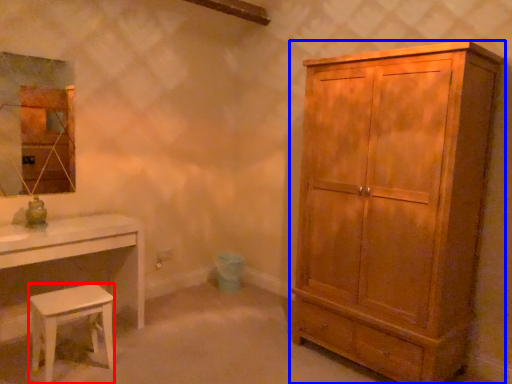
Question: Which object is further to the camera taking this photo, stool (highlighted by a red box) or cabinetry (highlighted by a blue box)?

Choices:
 (A) stool
 (B) cabinetry

Answer: (A)